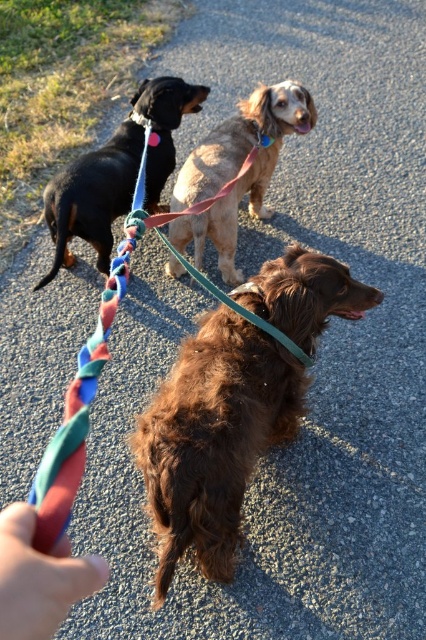
You are holding the leash of the brown furry dog at center and want to move it to your left. Which direction should you guide the dog to ensure it moves away from the smooth skin hand at lower left?

To move the brown furry dog at center away from the smooth skin hand at lower left, you should guide it to the left since the dog is currently positioned on the right side of the hand.

You are holding the leash of the brown furry dog at center while walking it. There is a smooth skin hand at lower left in the image. Is the hand above or below the dog?

The brown furry dog at center is positioned under the smooth skin hand at lower left, so the hand is above the dog.